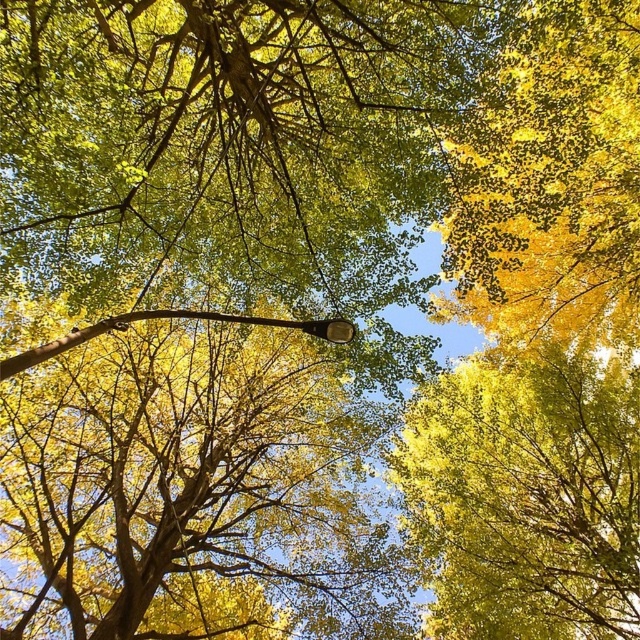
Question: From the image, what is the correct spatial relationship of smooth brown tree trunk at center in relation to yellow-green leaves at upper center?

Choices:
 (A) above
 (B) below

Answer: (B)

Question: Considering the relative positions of smooth brown tree trunk at center and yellow-green leaves at upper center in the image provided, where is smooth brown tree trunk at center located with respect to yellow-green leaves at upper center?

Choices:
 (A) below
 (B) above

Answer: (A)

Question: Which object appears closest to the camera in this image?

Choices:
 (A) smooth brown tree trunk at center
 (B) yellow-green leaves at upper center

Answer: (B)

Question: Which point is closer to the camera?

Choices:
 (A) yellow-green leaves at upper center
 (B) smooth brown tree trunk at center

Answer: (A)

Question: Is smooth brown tree trunk at center positioned in front of yellow-green leaves at upper center?

Choices:
 (A) yes
 (B) no

Answer: (B)